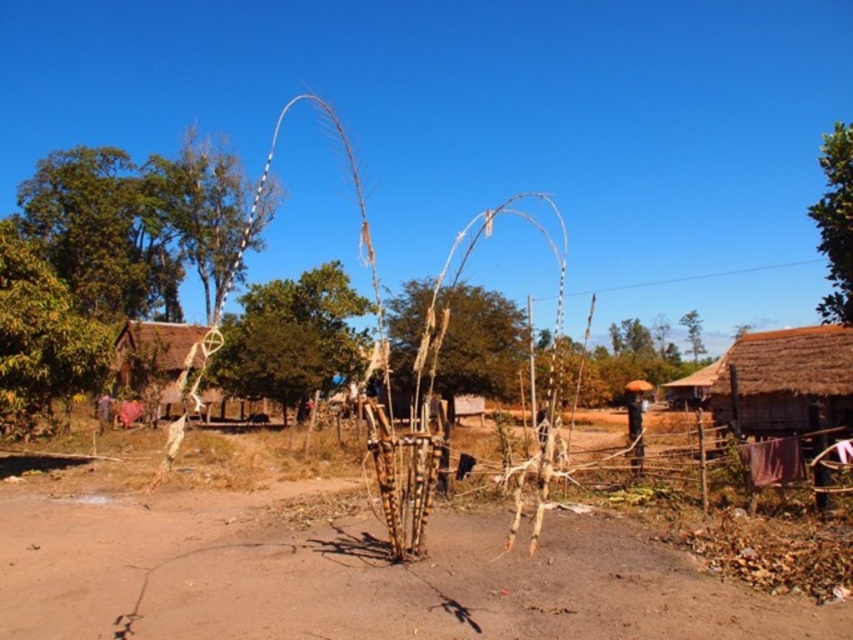
You are standing at the origin point of the coordinate system in the image, which is the bottom left corner. You want to walk towards the green leafy tree at center. In which general direction should you head?

The green leafy tree at center is located at point (291, 337). Since the coordinate system starts at the bottom left corner, the x increases to the right and y increases upwards. The tree is in the upper middle part of the image, so you should head northeast.

You are a hiker who needs to reach the green leafy tree at left from the brown dirt track at center. Given that your average walking speed is 1.5 meters per second, how many seconds will it take you to walk directly to the tree?

The distance between the brown dirt track at center and the green leafy tree at left is 56.54 meters. At a walking speed of 1.5 meters per second, it would take approximately 37.69 seconds to reach the tree. Since you can round to the nearest whole number, it would take about 38 seconds.

You are standing in the rural scene and want to walk from the green leafy tree at center to the green leafy tree at upper right. Which direction should you head to reach the tree at upper right?

To reach the green leafy tree at upper right from the green leafy tree at center, you should head to the right since the green leafy tree at center is positioned on the left side of the green leafy tree at upper right.